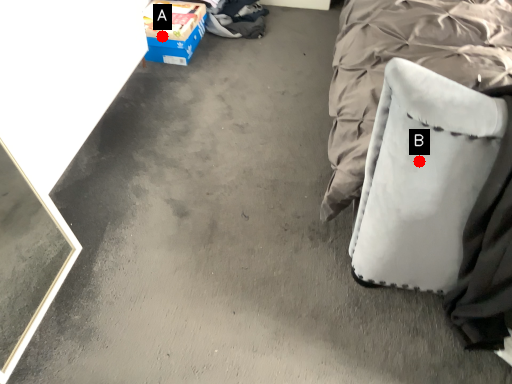
Question: Two points are circled on the image, labeled by A and B beside each circle. Which point appears closest to the camera in this image?

Choices:
 (A) A is closer
 (B) B is closer

Answer: (B)